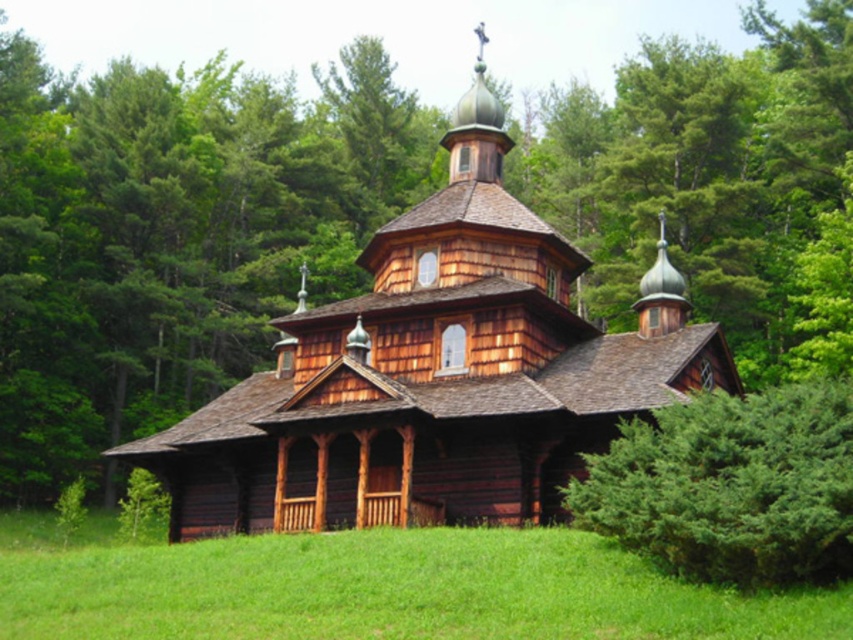
Image resolution: width=853 pixels, height=640 pixels. What do you see at coordinates (436, 372) in the screenshot?
I see `wooden church at center` at bounding box center [436, 372].

Is wooden church at center bigger than green grass at lower center?

Indeed, wooden church at center has a larger size compared to green grass at lower center.

Between point (399, 403) and point (306, 632), which one is positioned in front?

Point (306, 632)

What are the coordinates of `wooden church at center` in the screenshot? It's located at (436, 372).